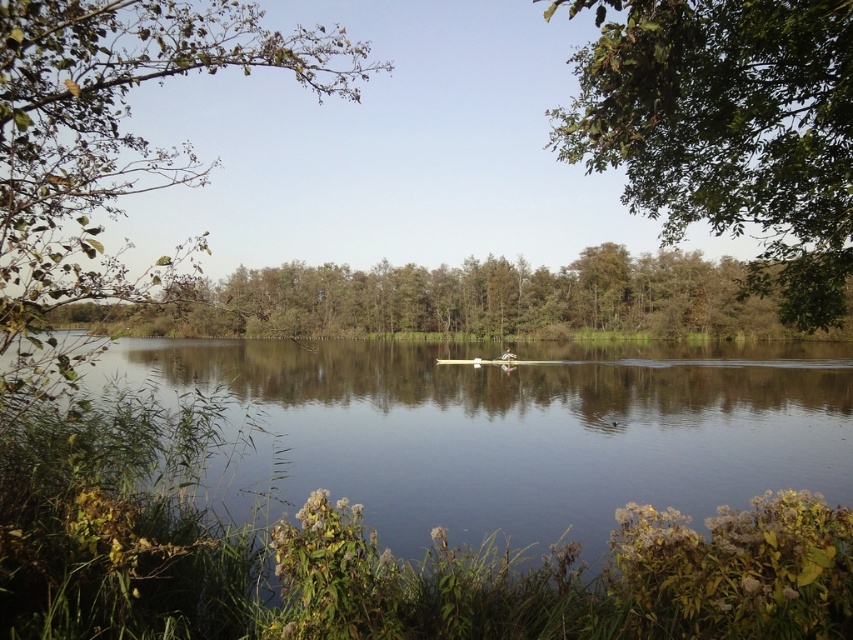
Question: Which point appears closest to the camera in this image?

Choices:
 (A) (109, 68)
 (B) (779, 269)
 (C) (346, 362)

Answer: (A)

Question: Considering the real-world distances, which object is farthest from the white plastic boat at center?

Choices:
 (A) clear water at center
 (B) green leafy branch at upper left

Answer: (B)

Question: Is green leafy branch at upper left bigger than white plastic boat at center?

Choices:
 (A) no
 (B) yes

Answer: (B)

Question: Is green leafy tree at upper right to the left of white plastic boat at center from the viewer's perspective?

Choices:
 (A) yes
 (B) no

Answer: (B)

Question: Does green leafy branch at upper left appear under white plastic boat at center?

Choices:
 (A) no
 (B) yes

Answer: (A)

Question: Which of the following is the closest to the observer?

Choices:
 (A) clear water at center
 (B) white plastic boat at center
 (C) green leafy branch at upper left

Answer: (A)